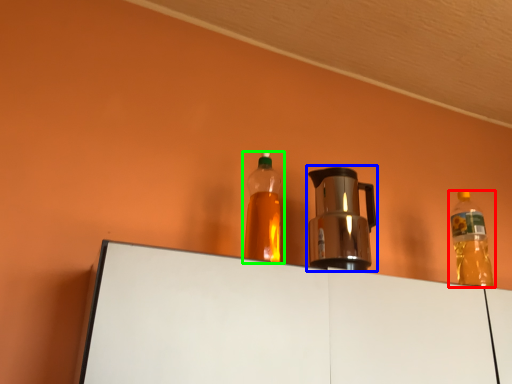
Question: Considering the real-world distances, which object is closest to bottle (highlighted by a red box)? coffeepot (highlighted by a blue box) or bottle (highlighted by a green box).

Choices:
 (A) coffeepot
 (B) bottle

Answer: (A)